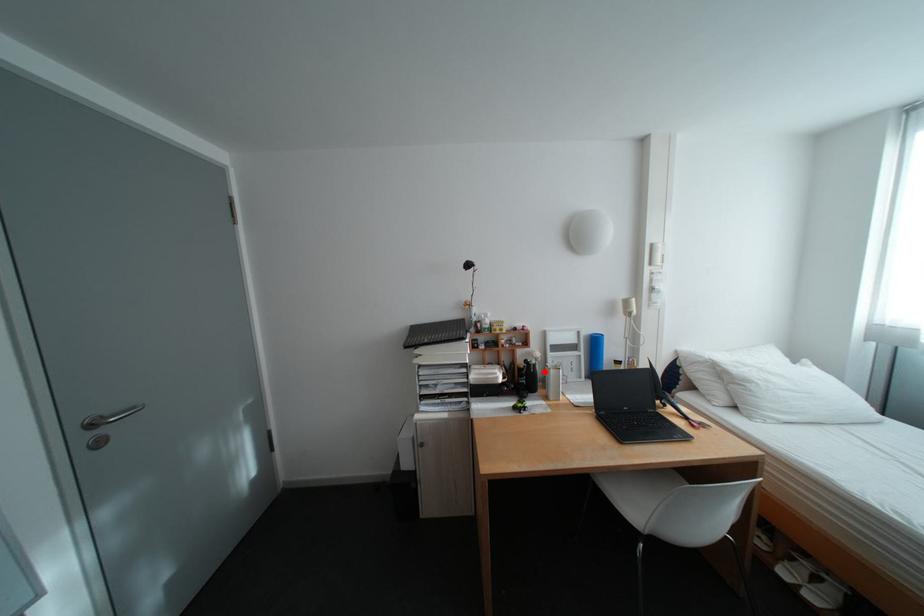
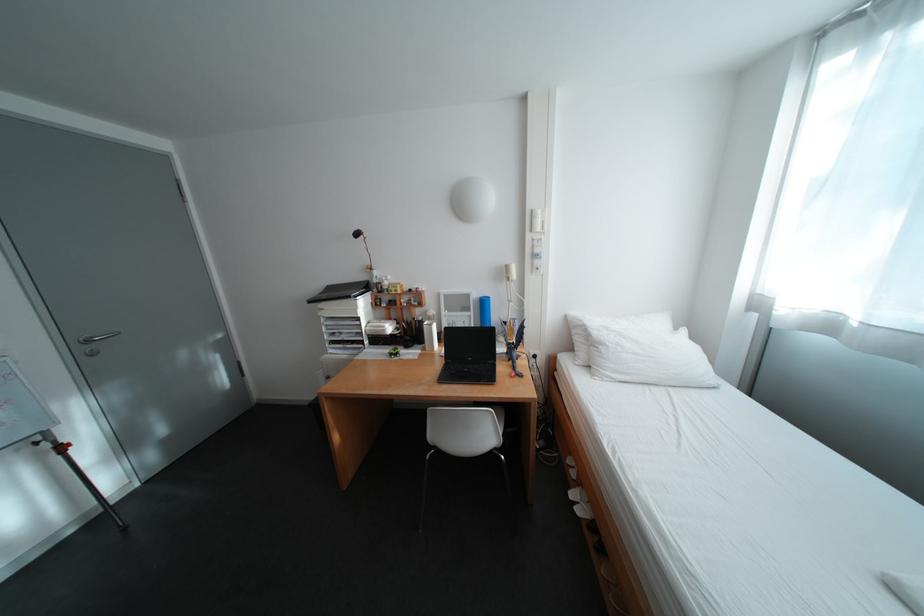
Find the pixel in the second image that matches the highlighted location in the first image.

(430, 326)